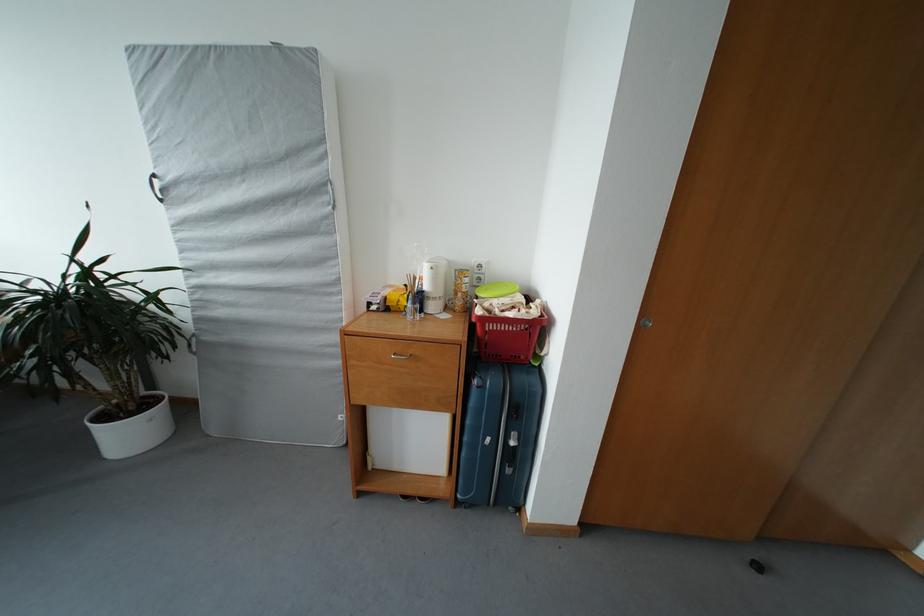
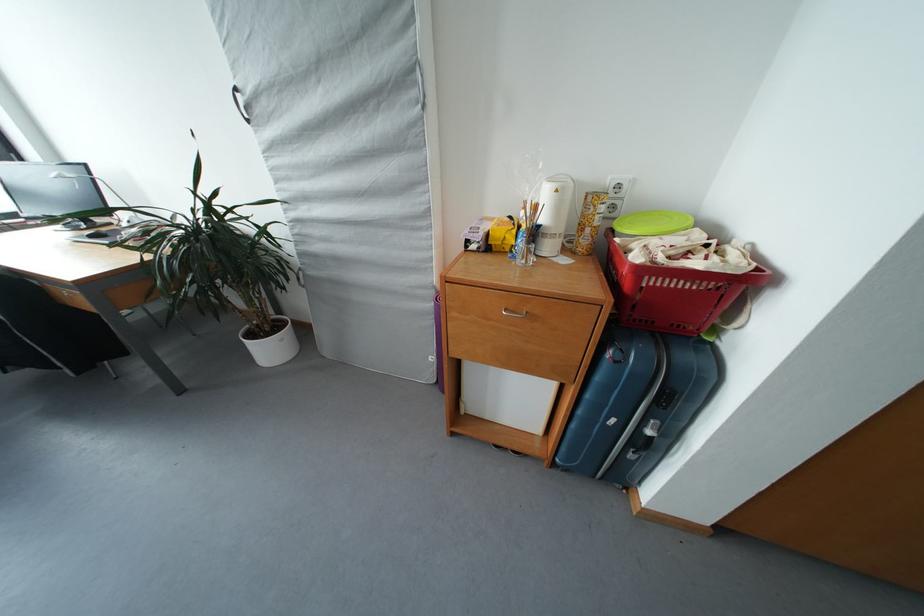
Locate, in the second image, the point that corresponds to [481,387] in the first image.

(616, 359)